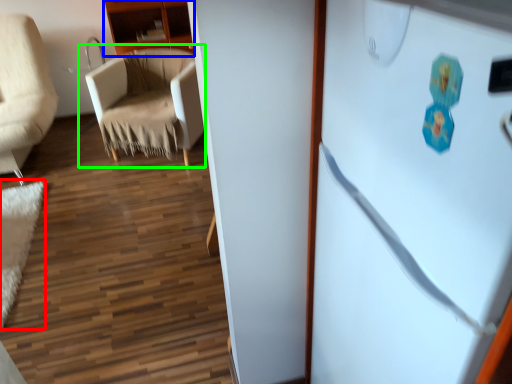
Question: Which object is the farthest from mat (highlighted by a red box)? Choose among these: cabinetry (highlighted by a blue box) or chair (highlighted by a green box).

Choices:
 (A) cabinetry
 (B) chair

Answer: (A)